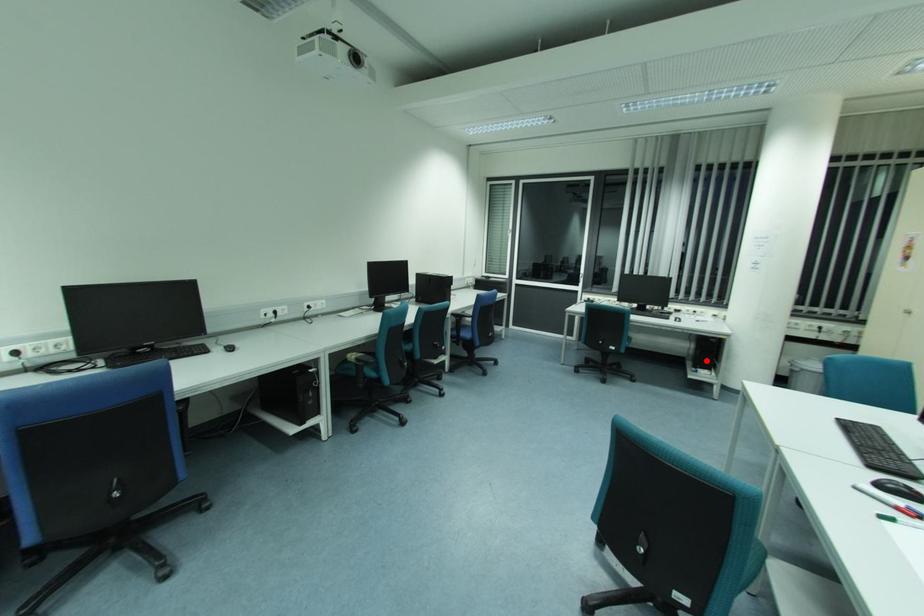
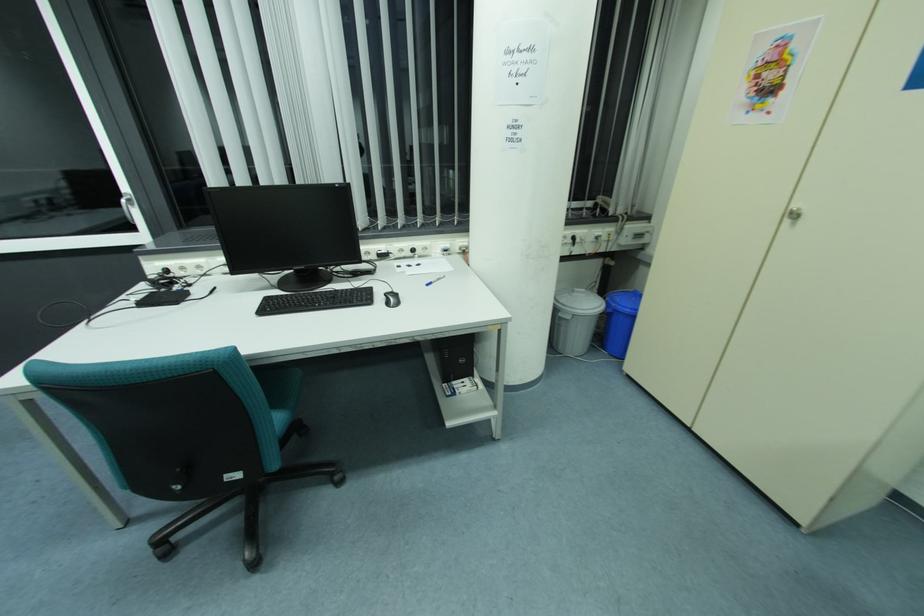
Question: I am providing you with two images of the same scene from different viewpoints. Given a red point in image1, look at the same physical point in image2. Is it:

Choices:
 (A) Closer to the viewpoint
 (B) Farther from the viewpoint

Answer: (B)